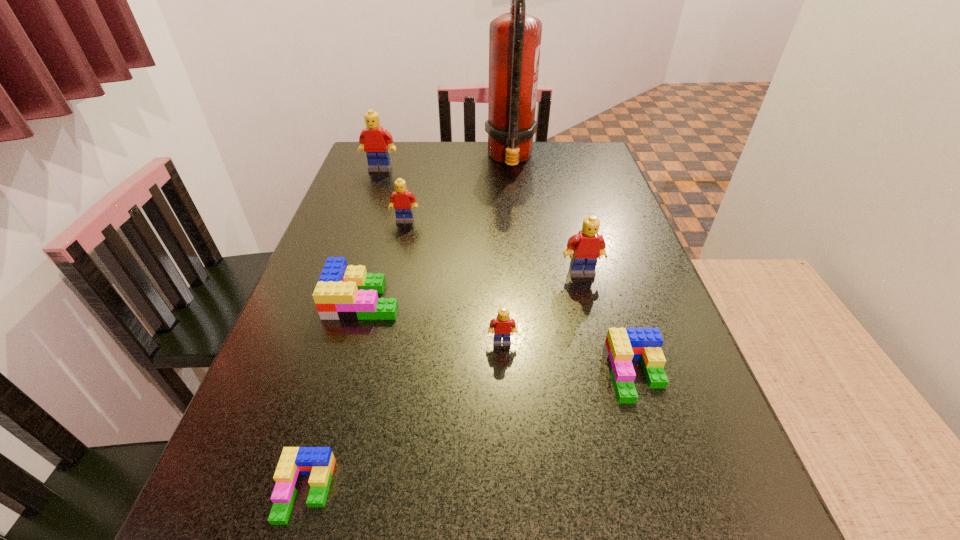
Identify the location of red fire extinguisher. (514, 38).

Image resolution: width=960 pixels, height=540 pixels. What are the coordinates of `the tallest object` in the screenshot? It's located at (514, 38).

In order to click on the biggest yellow Lego in this screenshot , I will do `click(374, 140)`.

Where is `the tallest Lego`? the tallest Lego is located at coordinates (374, 140).

Find the location of a particular element. The width and height of the screenshot is (960, 540). the third farthest Lego is located at coordinates (587, 245).

Where is `the third smallest yellow Lego`? The width and height of the screenshot is (960, 540). the third smallest yellow Lego is located at coordinates (587, 245).

The image size is (960, 540). I want to click on the fifth shortest object, so click(x=403, y=201).

This screenshot has width=960, height=540. I want to click on the third yellow Lego from right to left, so click(403, 201).

The width and height of the screenshot is (960, 540). What are the coordinates of `the third yellow Lego from left to right` in the screenshot? It's located at (503, 326).

I want to click on the fourth shortest object, so click(503, 326).